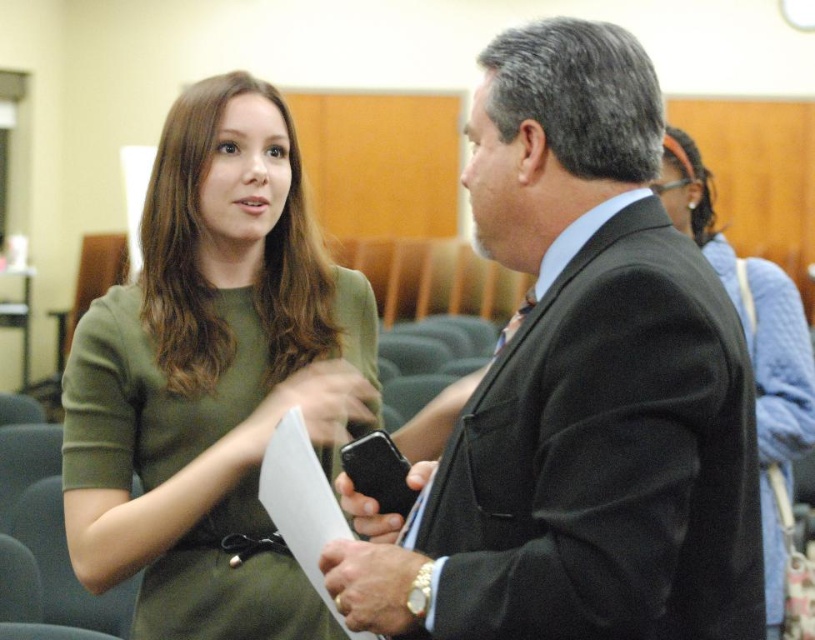
Question: Which object appears closest to the camera in this image?

Choices:
 (A) matte black suit at center
 (B) blue textured sweater at upper right
 (C) green matte dress at upper left

Answer: (A)

Question: Which of the following is the closest to the observer?

Choices:
 (A) blue textured sweater at upper right
 (B) matte black suit at center
 (C) green matte dress at upper left

Answer: (B)

Question: Does matte black suit at center have a greater width compared to blue textured sweater at upper right?

Choices:
 (A) yes
 (B) no

Answer: (A)

Question: Among these points, which one is farthest from the camera?

Choices:
 (A) (536, 28)
 (B) (773, 440)

Answer: (B)

Question: Does matte black suit at center have a greater width compared to green matte dress at upper left?

Choices:
 (A) no
 (B) yes

Answer: (A)

Question: Does matte black suit at center appear over green matte dress at upper left?

Choices:
 (A) yes
 (B) no

Answer: (A)